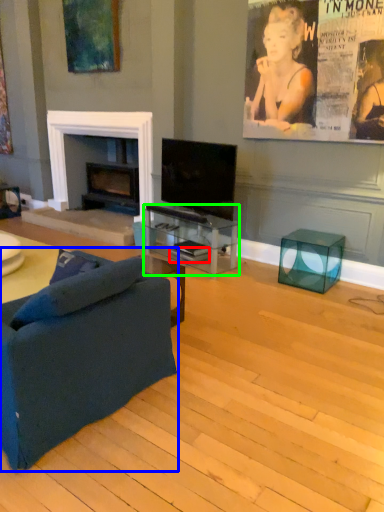
Question: Which object is positioned farthest from magazine (highlighted by a red box)? Select from studio couch (highlighted by a blue box) and table (highlighted by a green box).

Choices:
 (A) studio couch
 (B) table

Answer: (A)